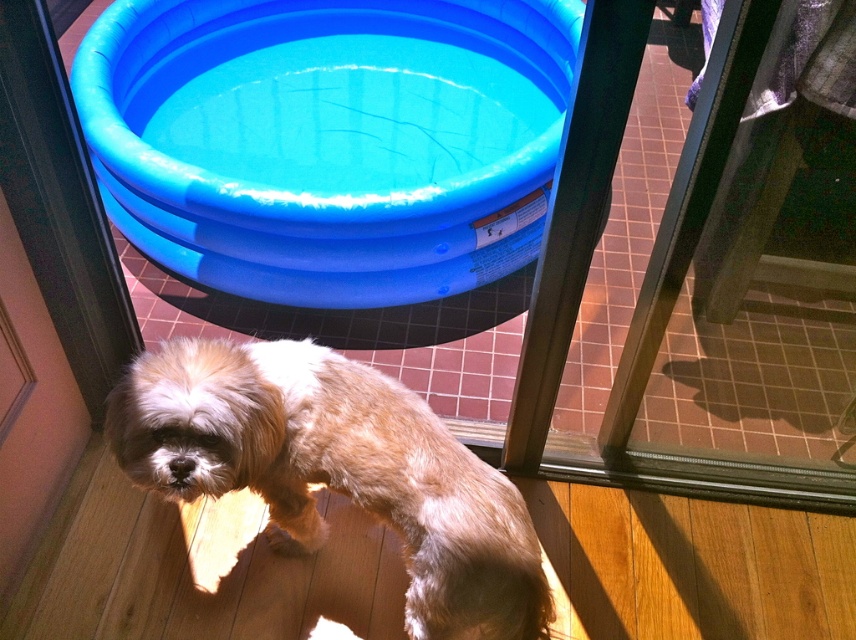
Question: Estimate the real-world distances between objects in this image. Which object is farther from the transparent glass door at center?

Choices:
 (A) golden fur dog at center
 (B) blue rubber pool at upper center

Answer: (B)

Question: Is blue rubber pool at upper center positioned in front of transparent glass door at center?

Choices:
 (A) no
 (B) yes

Answer: (A)

Question: Can you confirm if blue rubber pool at upper center is positioned to the right of golden fur dog at center?

Choices:
 (A) no
 (B) yes

Answer: (A)

Question: Which point appears closest to the camera in this image?

Choices:
 (A) (730, 480)
 (B) (325, 90)

Answer: (A)

Question: Which of the following is the farthest from the observer?

Choices:
 (A) (586, 60)
 (B) (431, 186)

Answer: (B)

Question: Does golden fur dog at center have a greater width compared to transparent glass door at center?

Choices:
 (A) no
 (B) yes

Answer: (A)